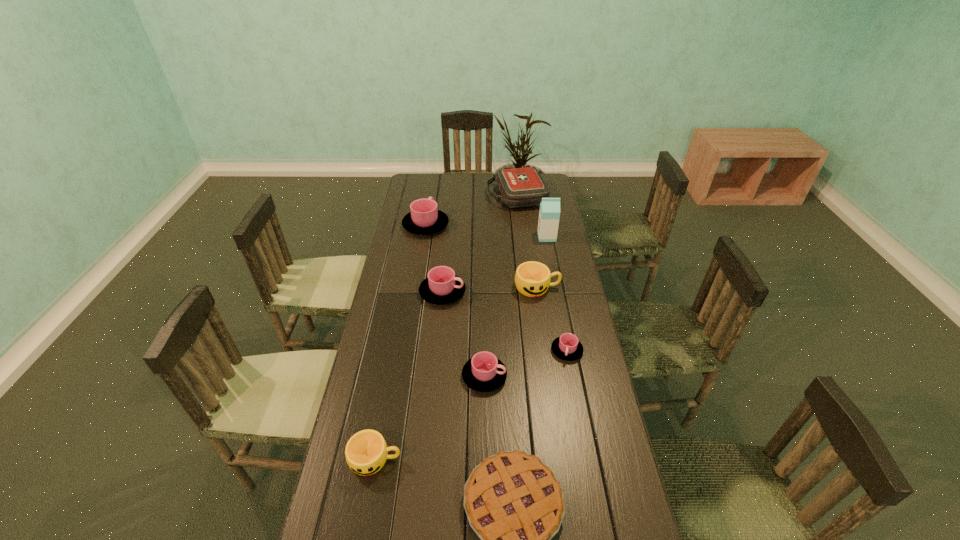
In order to click on pink cup that is the fourth nearest to the farther beige cup in this screenshot , I will do `click(424, 218)`.

Choose which pink cup is the second nearest neighbor to the red first-aid kit. Please provide its 2D coordinates. Your answer should be formatted as a tuple, i.e. [(x, y)], where the tuple contains the x and y coordinates of a point satisfying the conditions above.

[(442, 286)]

Locate which beige cup ranks second in proximity to the first-aid kit. Please provide its 2D coordinates. Your answer should be formatted as a tuple, i.e. [(x, y)], where the tuple contains the x and y coordinates of a point satisfying the conditions above.

[(366, 452)]

Where is `beige cup that stands as the second closest to the tallest cup`? The width and height of the screenshot is (960, 540). beige cup that stands as the second closest to the tallest cup is located at coordinates (366, 452).